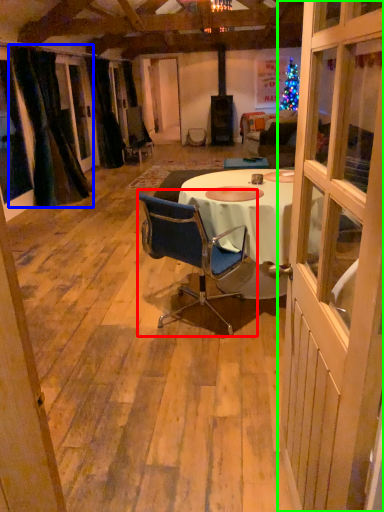
Question: Which object is the closest to the chair (highlighted by a red box)? Choose among these: curtain (highlighted by a blue box) or door (highlighted by a green box).

Choices:
 (A) curtain
 (B) door

Answer: (B)